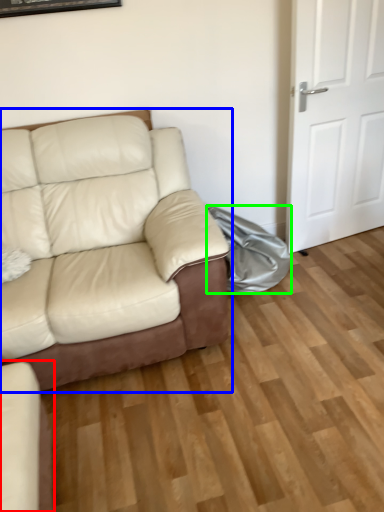
Question: Which object is positioned closest to studio couch (highlighted by a red box)? Select from studio couch (highlighted by a blue box) and material (highlighted by a green box).

Choices:
 (A) studio couch
 (B) material

Answer: (A)